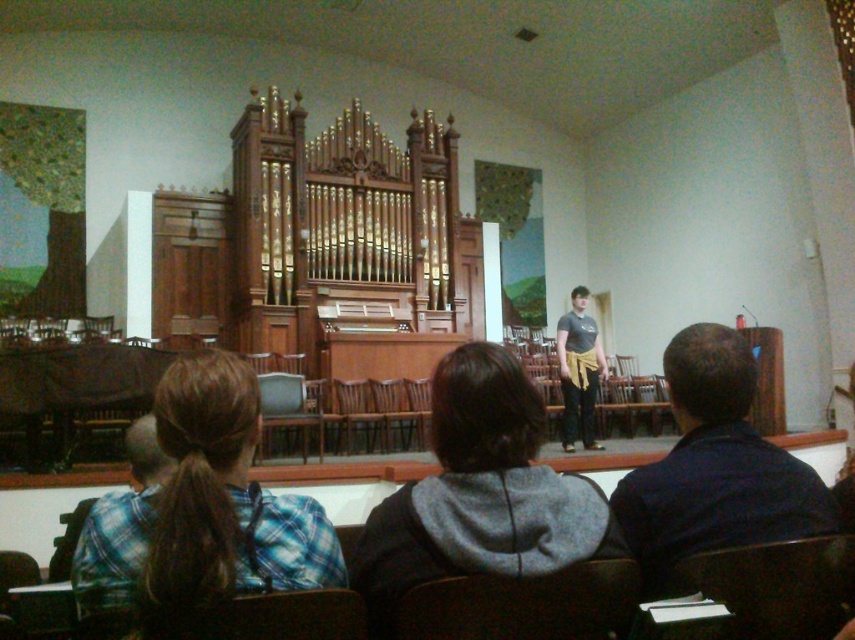
Can you confirm if brown leather chair at lower center is thinner than dark gray t-shirt at center?

Indeed, brown leather chair at lower center has a lesser width compared to dark gray t-shirt at center.

Can you confirm if brown leather chair at lower center is taller than dark gray t-shirt at center?

In fact, brown leather chair at lower center may be shorter than dark gray t-shirt at center.

Who is more distant from viewer, (590, 580) or (561, 360)?

Point (561, 360)

The height and width of the screenshot is (640, 855). What are the coordinates of `brown leather chair at lower center` in the screenshot? It's located at (525, 604).

Can you confirm if dark brown wood chair at lower right is smaller than plaid fabric shirt at lower left?

Indeed, dark brown wood chair at lower right has a smaller size compared to plaid fabric shirt at lower left.

Can you confirm if dark brown wood chair at lower right is shorter than plaid fabric shirt at lower left?

No, dark brown wood chair at lower right is not shorter than plaid fabric shirt at lower left.

Where is `dark brown wood chair at lower right`? dark brown wood chair at lower right is located at coordinates (777, 586).

In the scene shown: Can you confirm if gray fleece hoodie at center is positioned to the right of plaid fabric shirt at lower left?

Correct, you'll find gray fleece hoodie at center to the right of plaid fabric shirt at lower left.

Is gray fleece hoodie at center thinner than plaid fabric shirt at lower left?

In fact, gray fleece hoodie at center might be wider than plaid fabric shirt at lower left.

Locate an element on the screen. The image size is (855, 640). gray fleece hoodie at center is located at coordinates (479, 493).